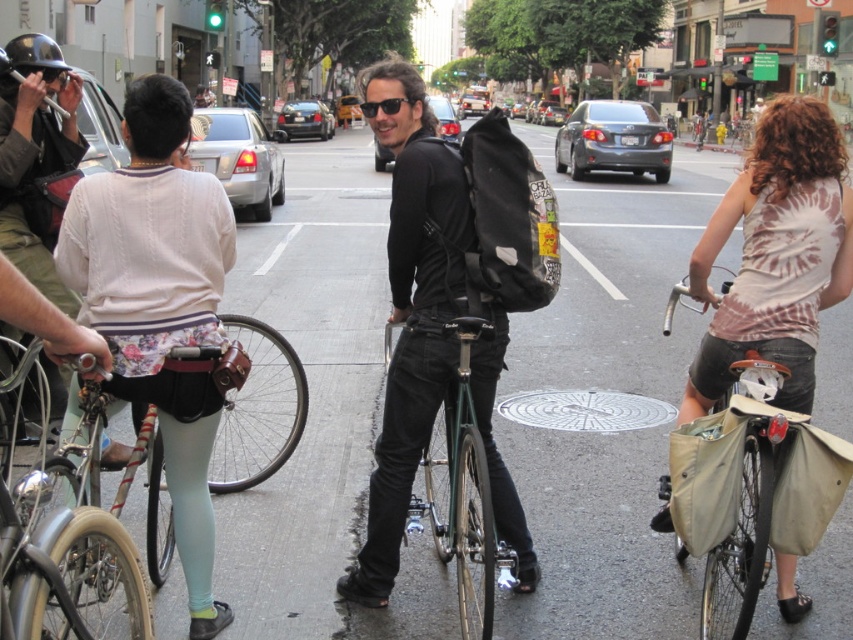
You are a delivery person who needs to secure a beige canvas bag at right onto a metallic silver bicycle at center. Based on the scene, can you attach the bag to the bicycle without moving it from its current position?

The beige canvas bag at right is in front of the metallic silver bicycle at center, so it is possible to attach the bag to the bicycle without moving it from its current position since it is already positioned in front of the bike.

In the urban street scene, there is a beige canvas bag at right located at point (746, 532). A delivery person needs to pick up a package from this location. Can they reach it without moving past the point?

The beige canvas bag at right is exactly at point (746, 532), so the delivery person can reach it without moving past that point.